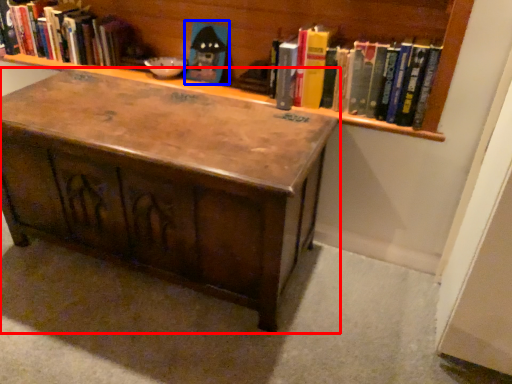
Question: Which point is closer to the camera, table (highlighted by a red box) or toy (highlighted by a blue box)?

Choices:
 (A) table
 (B) toy

Answer: (A)